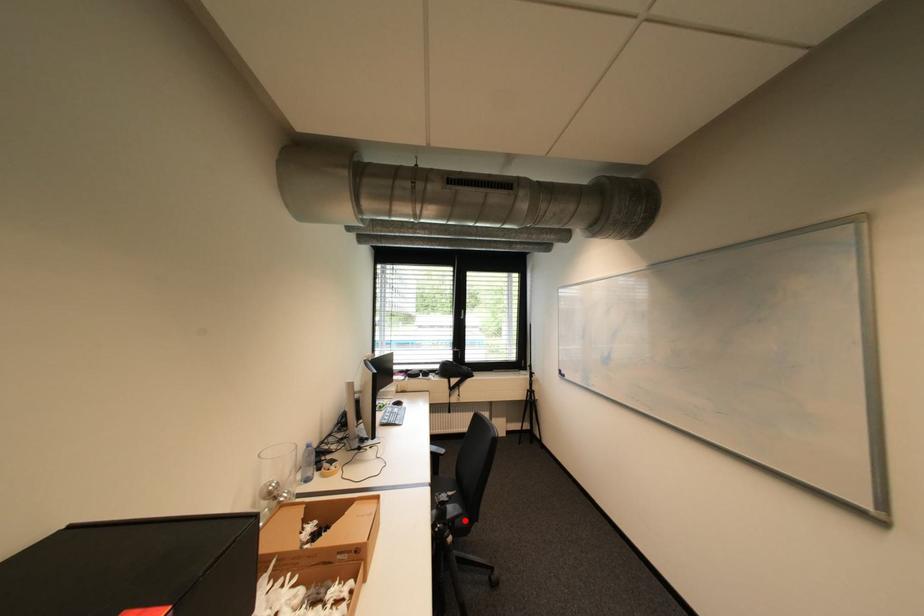
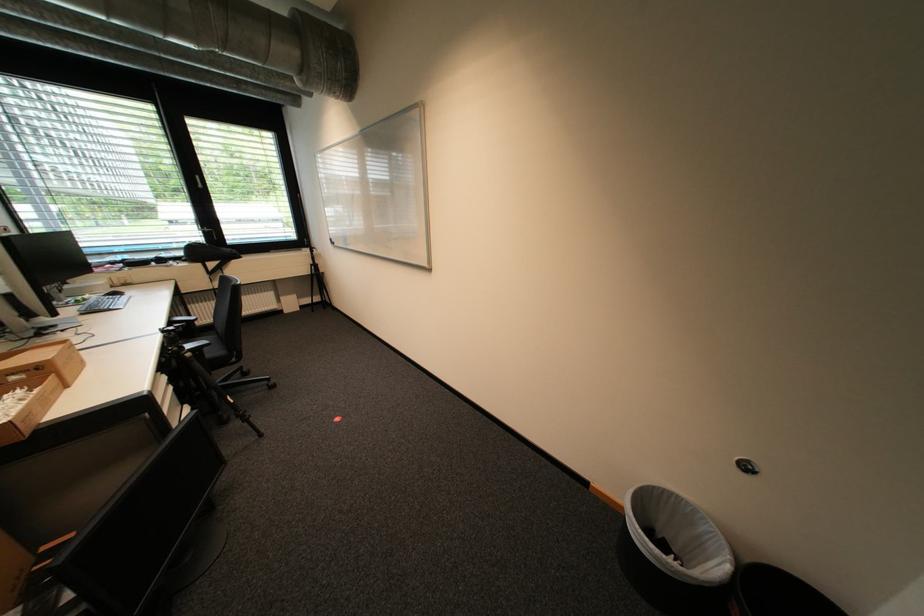
Question: I am providing you with two images of the same scene from different viewpoints. In image1, a red point is highlighted. Considering the same 3D point in image2, which of the following is correct?

Choices:
 (A) It is closer
 (B) It is farther

Answer: (A)